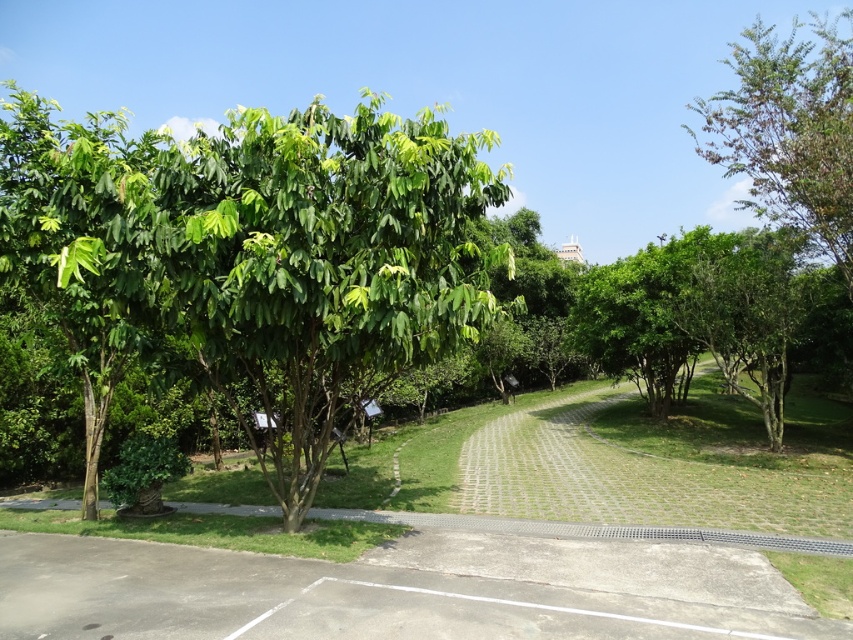
Question: Is green leafy tree at center positioned before green leafy tree at upper right?

Choices:
 (A) no
 (B) yes

Answer: (B)

Question: Which of the following is the farthest from the observer?

Choices:
 (A) (434, 630)
 (B) (825, 29)
 (C) (293, 189)

Answer: (B)

Question: Which is nearer to the green leafy tree at center?

Choices:
 (A) gray concrete path at lower center
 (B) green leafy tree at upper right

Answer: (A)

Question: Which of the following is the farthest from the observer?

Choices:
 (A) (196, 301)
 (B) (82, 593)
 (C) (833, 193)

Answer: (C)

Question: Can you confirm if gray concrete path at lower center is bigger than green leafy tree at upper right?

Choices:
 (A) no
 (B) yes

Answer: (A)

Question: Can you confirm if green leafy tree at center is positioned to the left of green leafy tree at upper right?

Choices:
 (A) no
 (B) yes

Answer: (B)